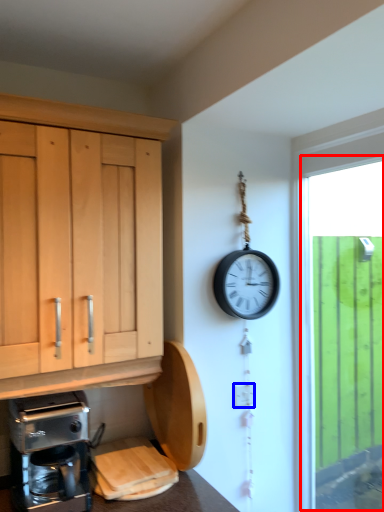
Question: Which object is further to the camera taking this photo, window (highlighted by a red box) or electric outlet (highlighted by a blue box)?

Choices:
 (A) window
 (B) electric outlet

Answer: (B)